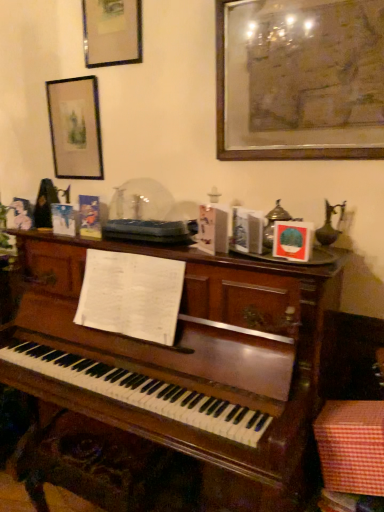
Question: Is checkered fabric box at lower right taller or shorter than matte black picture frame at upper left, arranged as the 2th picture frame when viewed from the right?

Choices:
 (A) tall
 (B) short

Answer: (B)

Question: In the image, is checkered fabric box at lower right on the left side or the right side of matte black picture frame at upper left, arranged as the second picture frame when viewed from the back?

Choices:
 (A) right
 (B) left

Answer: (A)

Question: Based on their relative distances, which object is farther from the checkered fabric box at lower right?

Choices:
 (A) matte black picture frame at upper left, placed as the 1th picture frame when sorted from back to front
 (B) wooden framed artwork at upper right, marked as the third picture frame in a back-to-front arrangement
 (C) matte black picture frame at upper left, arranged as the 2th picture frame when viewed from the right

Answer: (C)

Question: Which is nearer to the matte black picture frame at upper left, which appears as the 3th picture frame when viewed from the front?

Choices:
 (A) checkered fabric box at lower right
 (B) matte black picture frame at upper left, arranged as the second picture frame when viewed from the back
 (C) wooden framed artwork at upper right, the 1th picture frame from the front

Answer: (B)